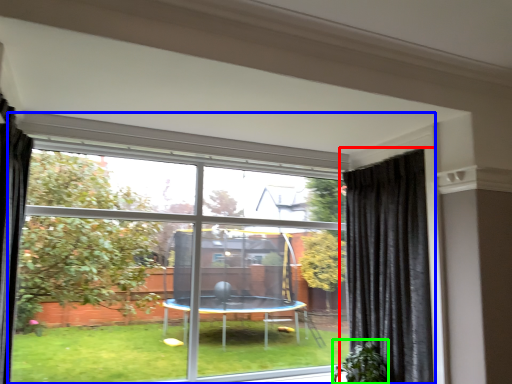
Question: Which object is positioned closest to curtain (highlighted by a red box)? Select from window (highlighted by a blue box) and plant (highlighted by a green box).

Choices:
 (A) window
 (B) plant

Answer: (B)